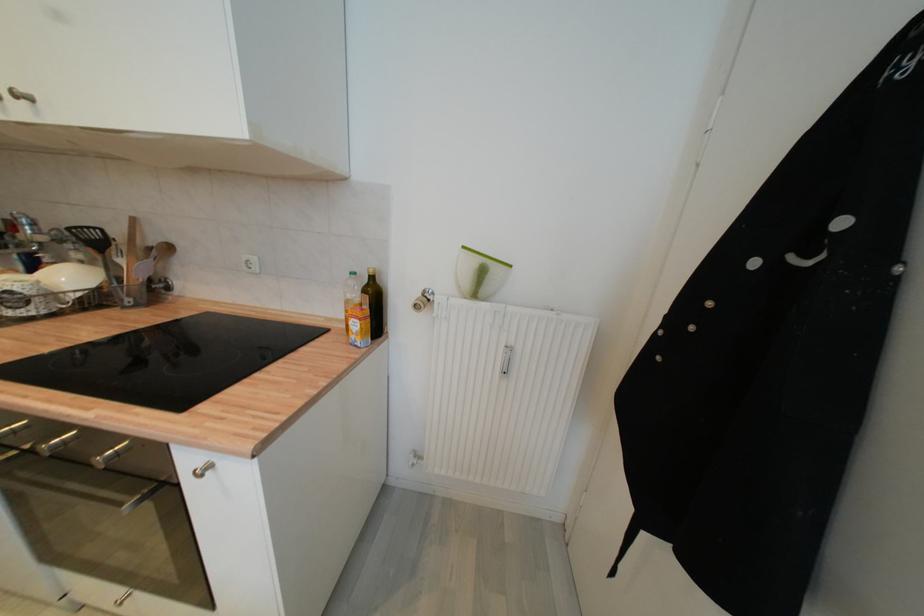
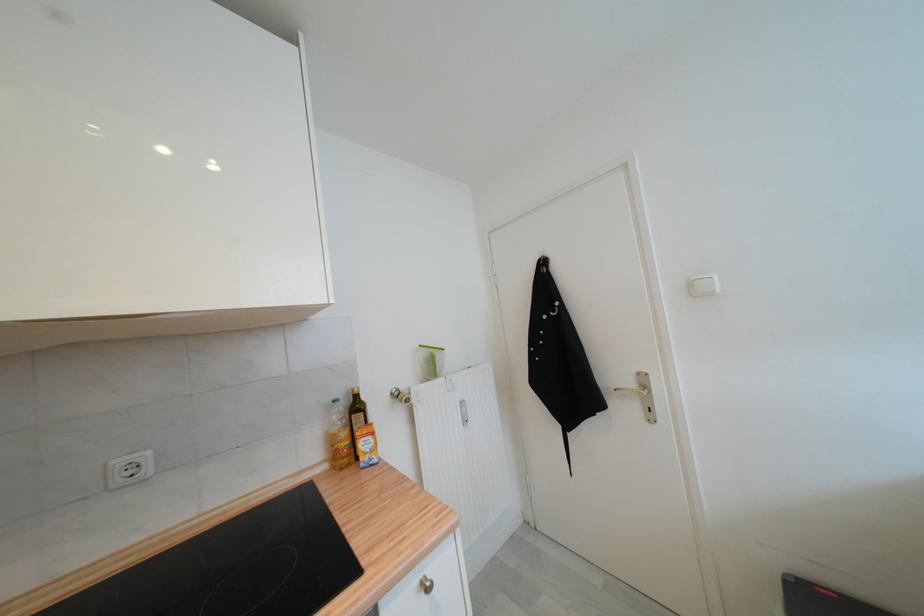
Locate, in the second image, the point that corresponds to the point at 468,249 in the first image.

(426, 347)